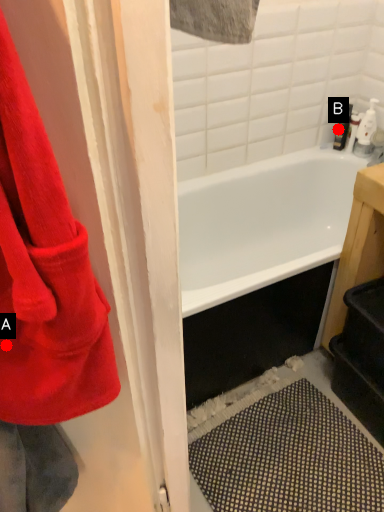
Question: Two points are circled on the image, labeled by A and B beside each circle. Which point is closer to the camera?

Choices:
 (A) A is closer
 (B) B is closer

Answer: (A)